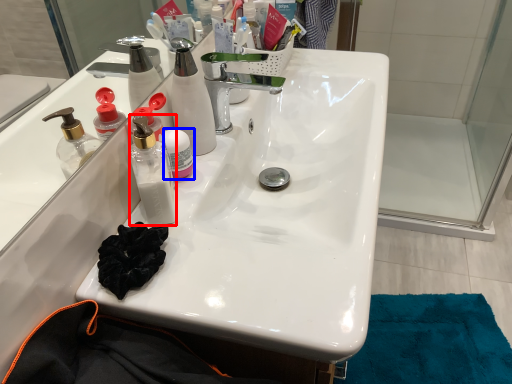
Question: Which of the following is the closest to the observer, bottle (highlighted by a red box) or bottle (highlighted by a blue box)?

Choices:
 (A) bottle
 (B) bottle

Answer: (A)